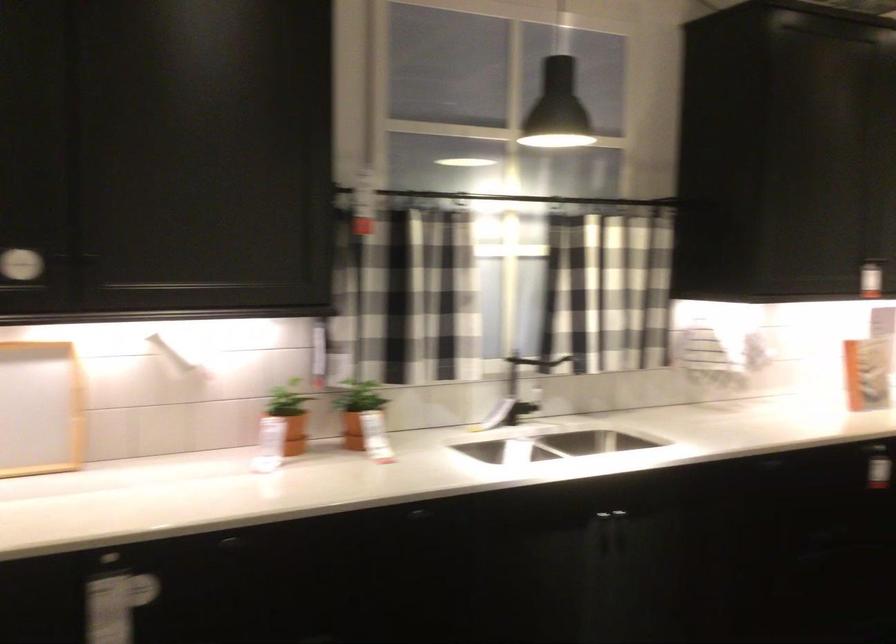
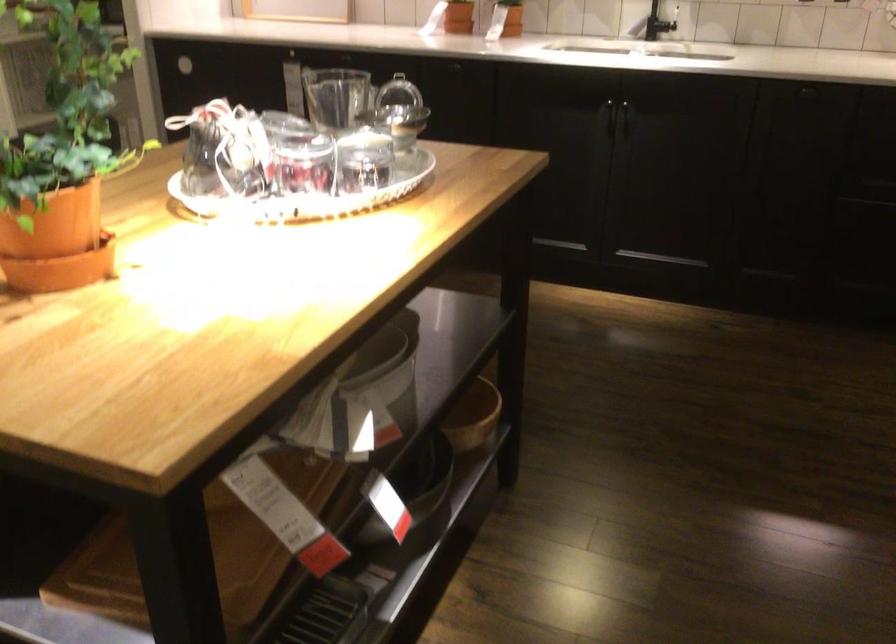
Where in the second image is the point corresponding to (x=383, y=451) from the first image?

(504, 31)